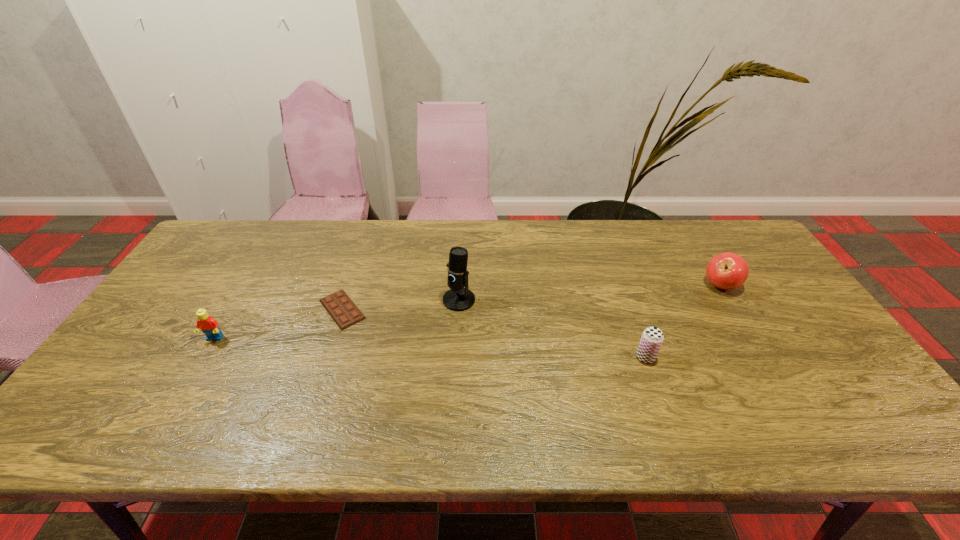
Identify the location of blank region between the rightmost object and the fourth object from right to left. This screenshot has height=540, width=960. (532, 298).

You are a GUI agent. You are given a task and a screenshot of the screen. Output one action in this format:
    pyautogui.click(x=<x>, y=<y>)
    Task: Click on the free area in between the microphone and the fourth object from right to left
    
    Given the screenshot: What is the action you would take?
    pyautogui.click(x=400, y=305)

Locate an element on the screen. This screenshot has width=960, height=540. unoccupied area between the beer can and the third object from left to right is located at coordinates (552, 328).

Where is `vacant space in between the fourth object from right to left and the apple`? vacant space in between the fourth object from right to left and the apple is located at coordinates (532, 298).

This screenshot has width=960, height=540. What are the coordinates of `vacant area between the apple and the chocolate bar` in the screenshot? It's located at (532, 298).

Locate an element on the screen. The width and height of the screenshot is (960, 540). free space that is in between the chocolate bar and the fourth farthest object is located at coordinates (278, 324).

At what (x,y) coordinates should I click in order to perform the action: click on free spot between the apple and the second nearest object. Please return your answer as a coordinate pair (x, y). The height and width of the screenshot is (540, 960). Looking at the image, I should click on (468, 312).

At what (x,y) coordinates should I click in order to perform the action: click on vacant region between the chocolate bar and the rightmost object. Please return your answer as a coordinate pair (x, y). Looking at the image, I should click on (532, 298).

The width and height of the screenshot is (960, 540). In order to click on vacant point located between the second object from left to right and the third object from left to right in this screenshot , I will do `click(400, 305)`.

Where is `the second closest object to the third object from right to left`? the second closest object to the third object from right to left is located at coordinates (652, 337).